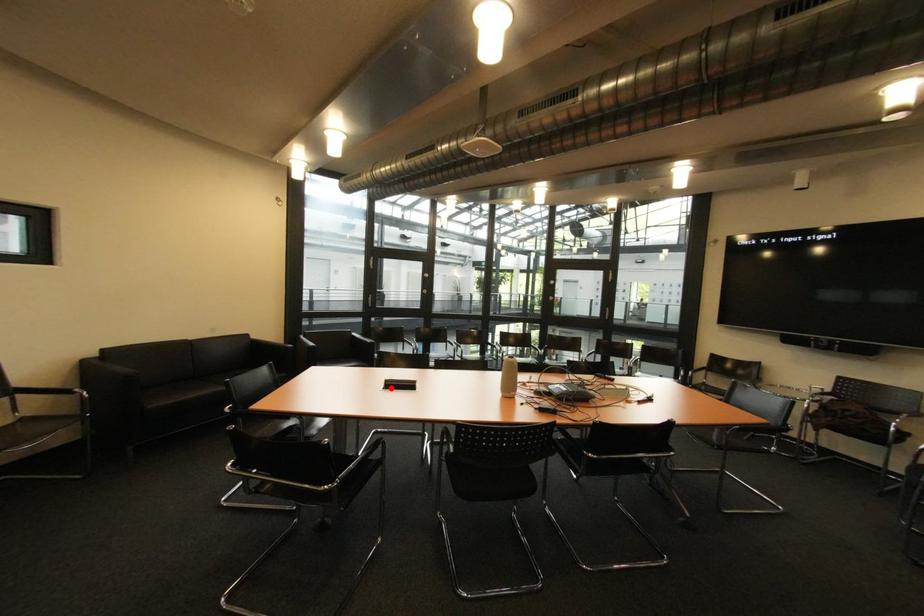
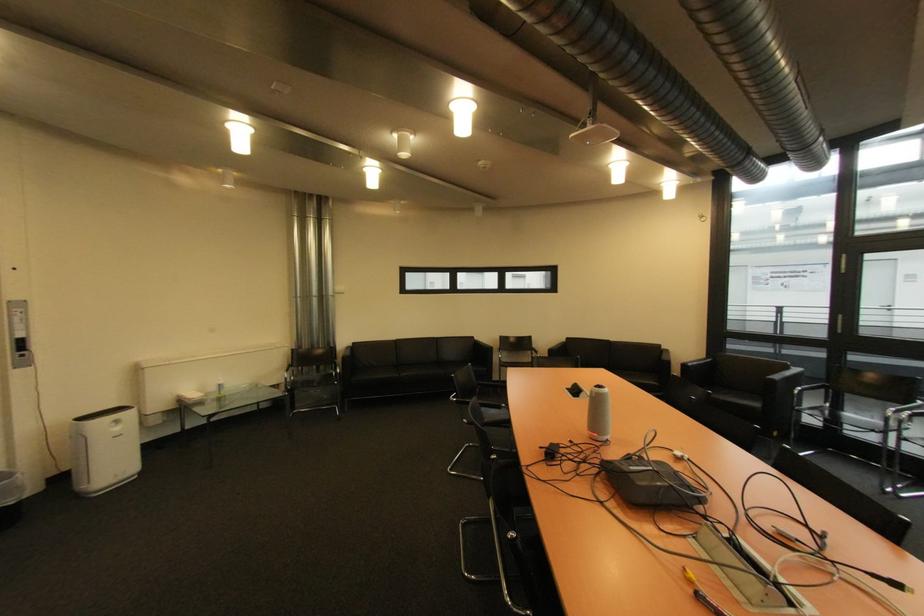
Where in the second image is the point corresponding to the highlighted location from the first image?

(578, 389)